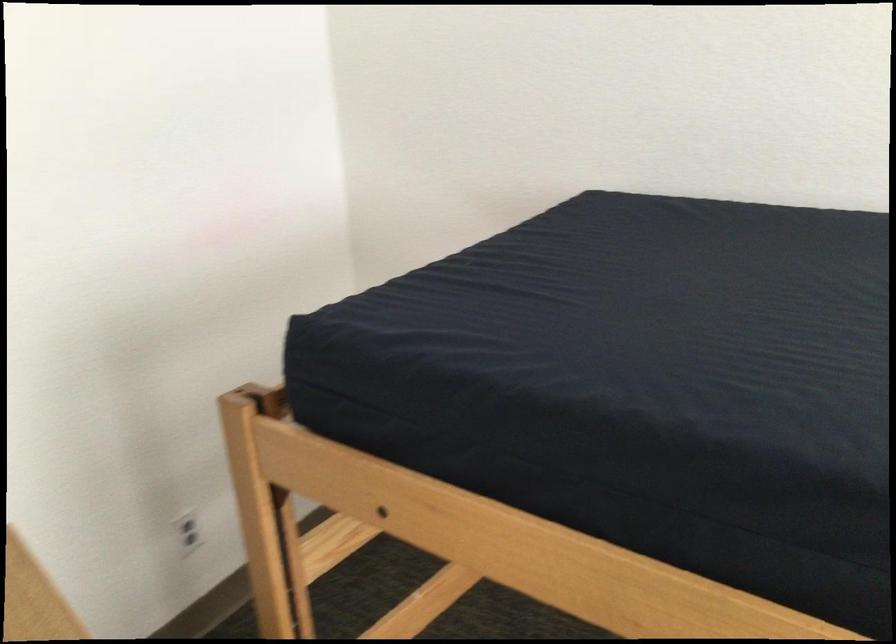
First-person continuous shooting, in which direction is the camera rotating?

The camera rotated toward right-down.